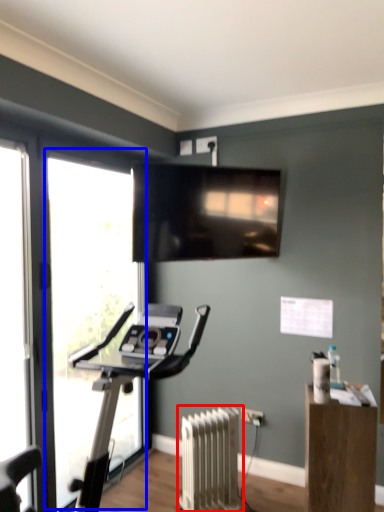
Question: Which object appears farthest to the camera in this image, radiator (highlighted by a red box) or window (highlighted by a blue box)?

Choices:
 (A) radiator
 (B) window

Answer: (A)